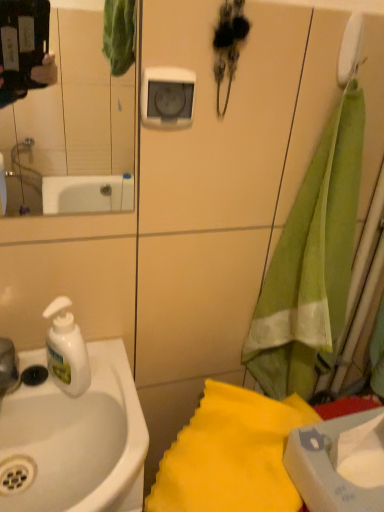
Question: Does clear glass mirror at upper left have a greater width compared to white glossy sink at left?

Choices:
 (A) yes
 (B) no

Answer: (B)

Question: From the image's perspective, is clear glass mirror at upper left on white glossy sink at left?

Choices:
 (A) no
 (B) yes

Answer: (B)

Question: Does clear glass mirror at upper left come behind white glossy sink at left?

Choices:
 (A) no
 (B) yes

Answer: (A)

Question: Does clear glass mirror at upper left have a larger size compared to white glossy sink at left?

Choices:
 (A) yes
 (B) no

Answer: (B)

Question: Considering the relative sizes of clear glass mirror at upper left and white glossy sink at left in the image provided, is clear glass mirror at upper left taller than white glossy sink at left?

Choices:
 (A) yes
 (B) no

Answer: (A)

Question: Is clear glass mirror at upper left not within white glossy sink at left?

Choices:
 (A) yes
 (B) no

Answer: (A)

Question: Is white glossy sink at left thinner than clear glass mirror at upper left?

Choices:
 (A) yes
 (B) no

Answer: (B)

Question: Can you confirm if white glossy sink at left is positioned to the left of clear glass mirror at upper left?

Choices:
 (A) yes
 (B) no

Answer: (B)

Question: Is white glossy sink at left turned away from clear glass mirror at upper left?

Choices:
 (A) yes
 (B) no

Answer: (B)

Question: Is white glossy sink at left bigger than clear glass mirror at upper left?

Choices:
 (A) no
 (B) yes

Answer: (B)

Question: Considering the relative sizes of white glossy sink at left and clear glass mirror at upper left in the image provided, is white glossy sink at left shorter than clear glass mirror at upper left?

Choices:
 (A) no
 (B) yes

Answer: (B)

Question: Is white glossy sink at left taller than clear glass mirror at upper left?

Choices:
 (A) yes
 (B) no

Answer: (B)

Question: Can you confirm if green fabric towel at right, the first beach towel positioned from the top, is shorter than white plastic faucet at left?

Choices:
 (A) yes
 (B) no

Answer: (B)